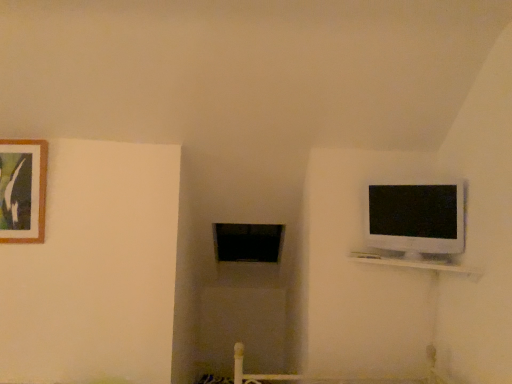
At what (x,y) coordinates should I click in order to perform the action: click on vacant area situated below white glossy television at upper right (from a real-world perspective). Please return your answer as a coordinate pair (x, y). The width and height of the screenshot is (512, 384). Looking at the image, I should click on click(404, 261).